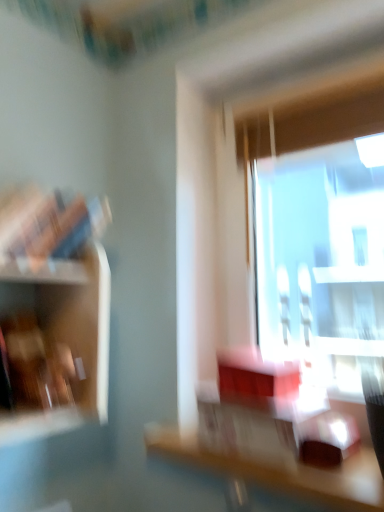
Question: Is wooden table at center thinner than wooden shelf at left?

Choices:
 (A) yes
 (B) no

Answer: (B)

Question: From a real-world perspective, is wooden table at center beneath wooden shelf at left?

Choices:
 (A) no
 (B) yes

Answer: (B)

Question: From a real-world perspective, is wooden table at center over wooden shelf at left?

Choices:
 (A) no
 (B) yes

Answer: (A)

Question: Can you confirm if wooden table at center is shorter than wooden shelf at left?

Choices:
 (A) yes
 (B) no

Answer: (A)

Question: From the image's perspective, is wooden table at center under wooden shelf at left?

Choices:
 (A) no
 (B) yes

Answer: (B)

Question: Is wooden table at center at the left side of wooden shelf at left?

Choices:
 (A) no
 (B) yes

Answer: (A)

Question: Can you confirm if wooden shelf at left is taller than wooden table at center?

Choices:
 (A) yes
 (B) no

Answer: (A)

Question: Is wooden shelf at left positioned with its back to wooden table at center?

Choices:
 (A) yes
 (B) no

Answer: (B)

Question: Is wooden shelf at left not inside wooden table at center?

Choices:
 (A) yes
 (B) no

Answer: (A)

Question: From the image's perspective, would you say wooden shelf at left is shown under wooden table at center?

Choices:
 (A) yes
 (B) no

Answer: (B)

Question: Considering the relative positions of wooden shelf at left and wooden table at center in the image provided, is wooden shelf at left to the right of wooden table at center from the viewer's perspective?

Choices:
 (A) yes
 (B) no

Answer: (B)

Question: Can you confirm if wooden shelf at left is shorter than wooden table at center?

Choices:
 (A) yes
 (B) no

Answer: (B)

Question: Relative to wooden table at center, is wooden shelf at left in front or behind?

Choices:
 (A) front
 (B) behind

Answer: (B)